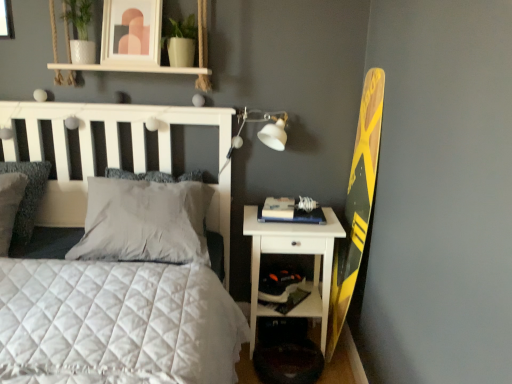
Where is `vacant space situated above white plastic shelf at lower right (from a real-world perspective)`? The height and width of the screenshot is (384, 512). vacant space situated above white plastic shelf at lower right (from a real-world perspective) is located at coordinates (280, 268).